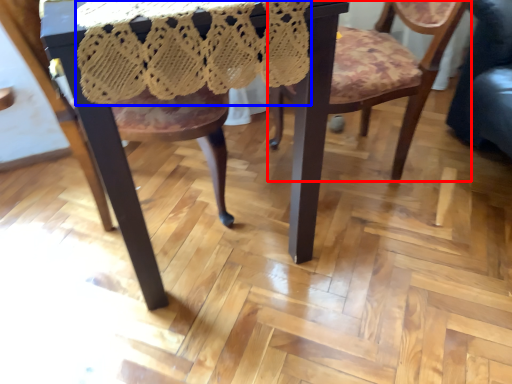
Question: Among these objects, which one is farthest to the camera, chair (highlighted by a red box) or lace dress (highlighted by a blue box)?

Choices:
 (A) chair
 (B) lace dress

Answer: (A)